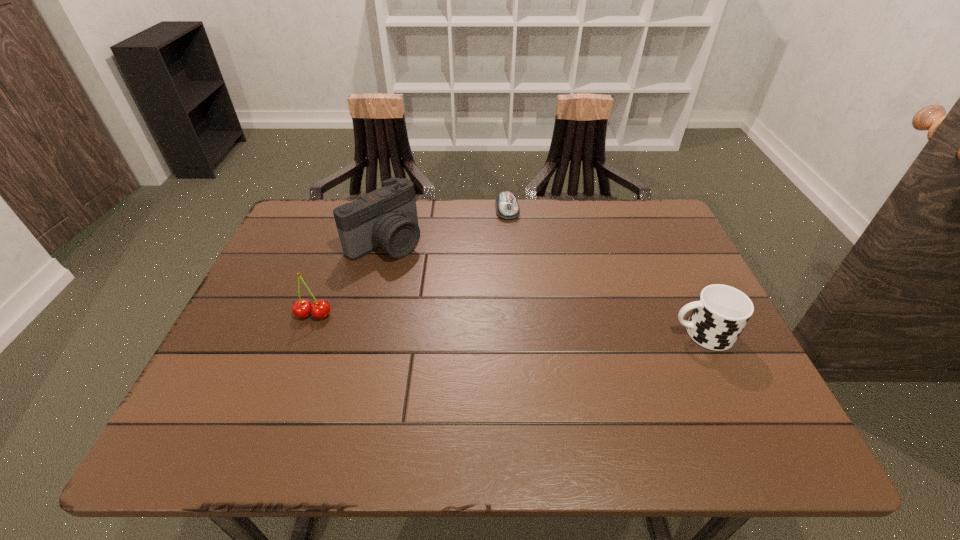
Image resolution: width=960 pixels, height=540 pixels. Find the location of `free space on the desktop that is between the cherry and the rightmost object and is positioned at the lens of the tallest object`. free space on the desktop that is between the cherry and the rightmost object and is positioned at the lens of the tallest object is located at coordinates (494, 323).

This screenshot has width=960, height=540. Identify the location of vacant spot on the desktop that is between the cherry and the rightmost object and is positioned on the wheel side of the second object from right to left. (536, 325).